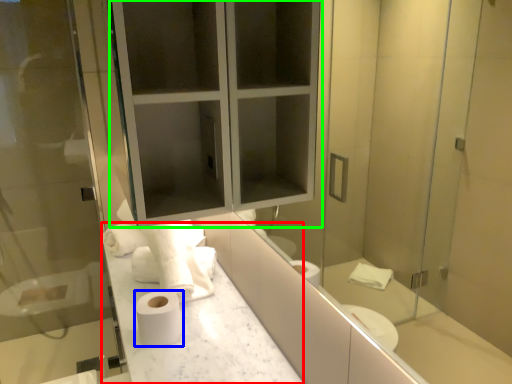
Question: Which is farther away from counter top (highlighted by a red box)? toilet paper (highlighted by a blue box) or medicine cabinet (highlighted by a green box)?

Choices:
 (A) toilet paper
 (B) medicine cabinet

Answer: (B)